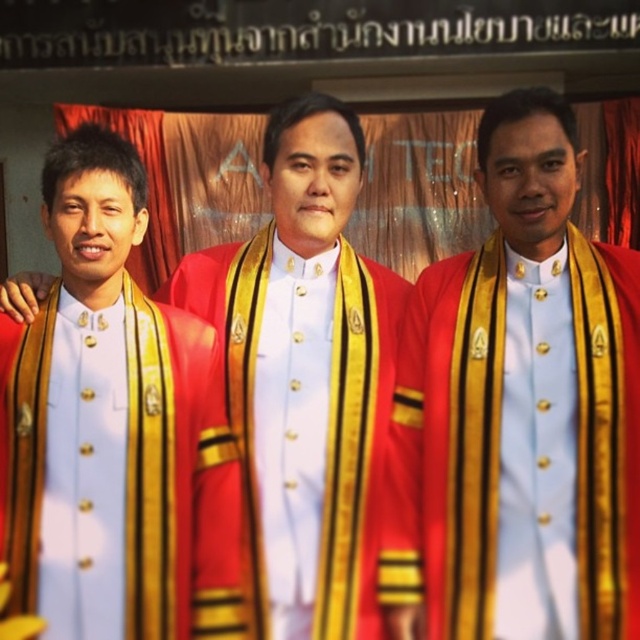
Is matte gold scarf at center below red velvet robe at center?

Incorrect, matte gold scarf at center is not positioned below red velvet robe at center.

Does point (540, 589) lie in front of point (244, 266)?

Yes, point (540, 589) is in front of point (244, 266).

Which is behind, point (506, 276) or point (179, 296)?

The point (179, 296) is behind.

Image resolution: width=640 pixels, height=640 pixels. Identify the location of matte gold scarf at center. click(x=531, y=401).

Can you confirm if matte gold sash at center is thinner than red velvet robe at center?

Incorrect, matte gold sash at center's width is not less than red velvet robe at center's.

Does matte gold sash at center have a lesser height compared to red velvet robe at center?

No.

This screenshot has height=640, width=640. What do you see at coordinates (305, 376) in the screenshot?
I see `matte gold sash at center` at bounding box center [305, 376].

Identify the location of matte gold sash at center. This screenshot has width=640, height=640. click(305, 376).

Is point (320, 564) in front of point (184, 424)?

That is False.

Can you confirm if matte gold sash at center is wider than matte gold uniform at center?

Indeed, matte gold sash at center has a greater width compared to matte gold uniform at center.

Who is more distant from viewer, (284,349) or (163,316)?

Positioned behind is point (284,349).

The image size is (640, 640). Find the location of `matte gold sash at center`. matte gold sash at center is located at coordinates (305, 376).